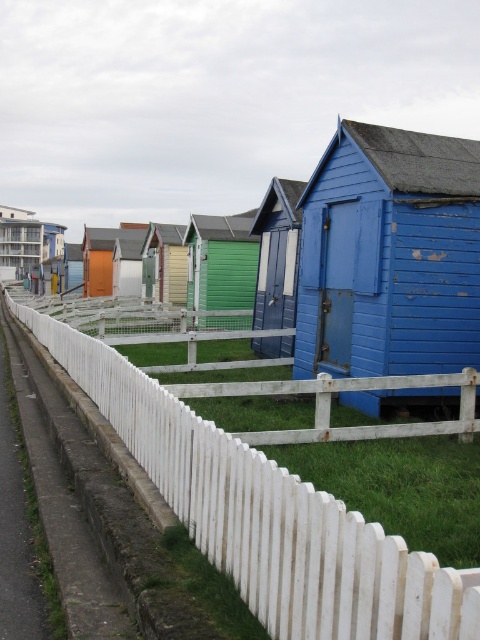
Is point (291, 531) positioned behind point (7, 266)?

No, it is not.

In the scene shown: Who is positioned more to the right, white picket fence at lower left or matte orange hut at left?

white picket fence at lower left

Is point (408, 592) behind point (24, 264)?

That is False.

The image size is (480, 640). What are the coordinates of `white picket fence at lower left` in the screenshot? It's located at (266, 515).

Is point (362, 148) positioned after point (171, 294)?

No.

Locate an element on the screen. The image size is (480, 640). blue wooden beach hut at center is located at coordinates (389, 256).

This screenshot has width=480, height=640. Find the location of `blue wooden beach hut at center`. blue wooden beach hut at center is located at coordinates (389, 256).

Does point (279, 493) lie in front of point (223, 291)?

Yes, it is in front of point (223, 291).

Locate an element on the screen. white picket fence at lower left is located at coordinates tap(266, 515).

What do you see at coordinates (266, 515) in the screenshot? I see `white picket fence at lower left` at bounding box center [266, 515].

Where is `white picket fence at lower left`? white picket fence at lower left is located at coordinates (266, 515).